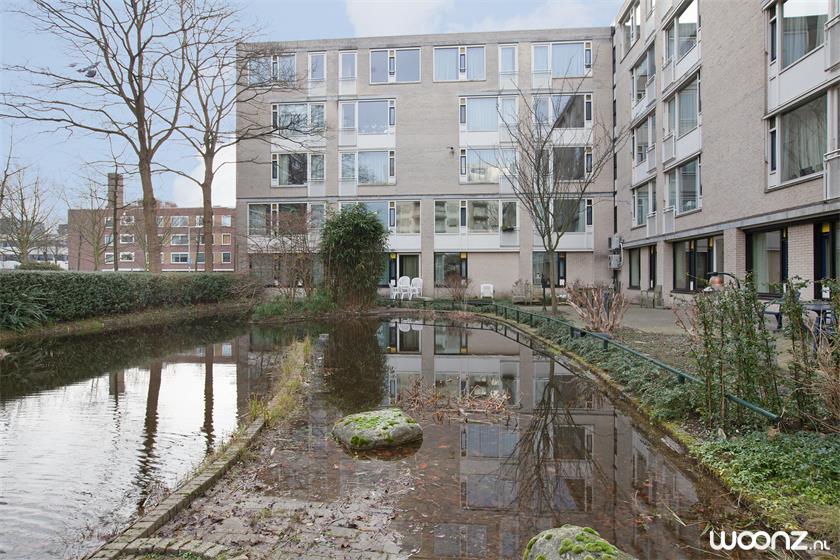
Where is `brick chimney`? Image resolution: width=840 pixels, height=560 pixels. brick chimney is located at coordinates (118, 195).